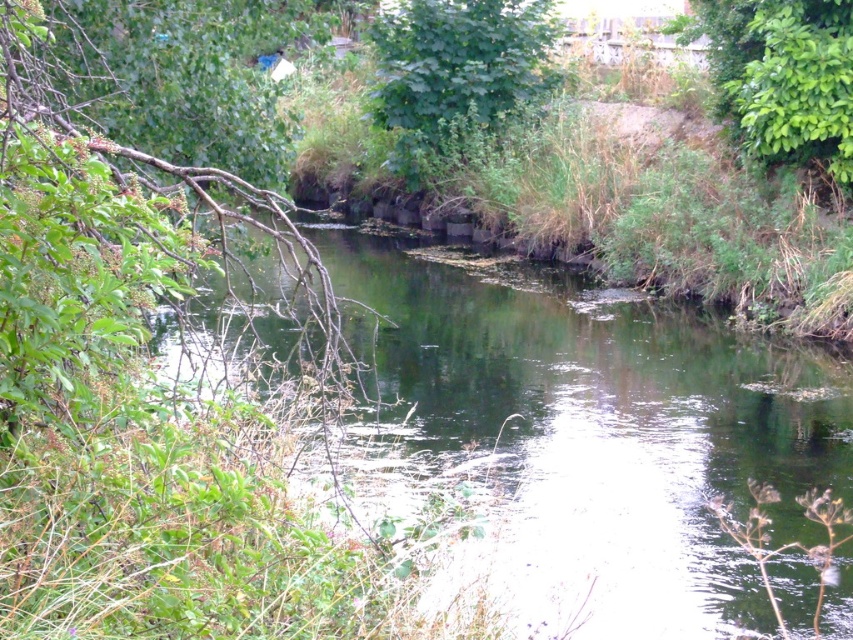
Question: Which of the following is the farthest from the observer?

Choices:
 (A) (248, 173)
 (B) (491, 58)
 (C) (590, 579)
 (D) (804, 42)

Answer: (B)

Question: Is green leafy tree at upper left further to camera compared to green leafy tree at upper center?

Choices:
 (A) no
 (B) yes

Answer: (A)

Question: Which object is positioned farthest from the green leafy tree at upper left?

Choices:
 (A) green leafy bush at upper right
 (B) green grassy stream at center

Answer: (A)

Question: Which of these objects is positioned closest to the green leafy tree at upper center?

Choices:
 (A) green grassy stream at center
 (B) green leafy tree at upper left
 (C) green leafy bush at upper right

Answer: (A)

Question: Is green grassy stream at center wider than green leafy tree at upper left?

Choices:
 (A) no
 (B) yes

Answer: (B)

Question: From the image, what is the correct spatial relationship of green leafy tree at upper center in relation to green leafy bush at upper right?

Choices:
 (A) below
 (B) above

Answer: (B)